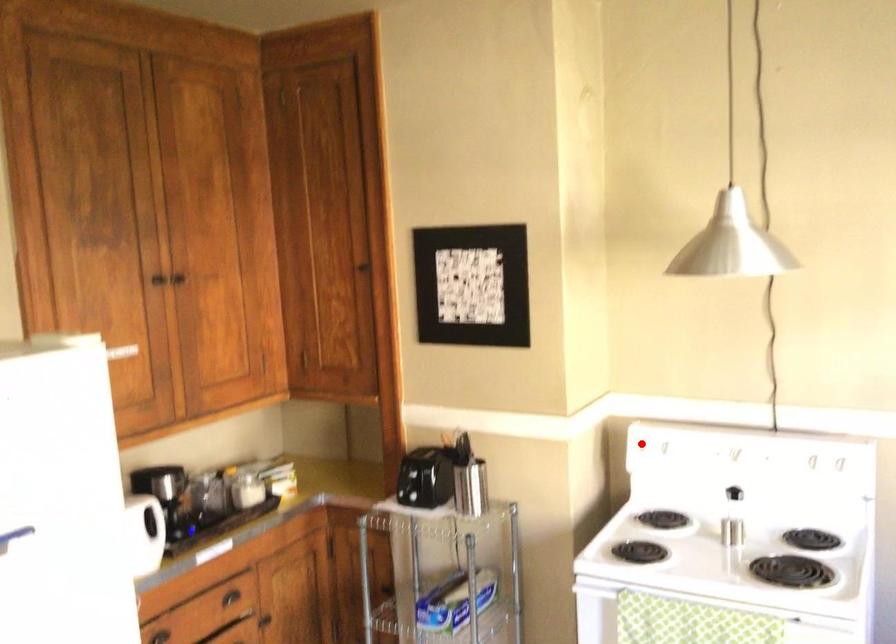
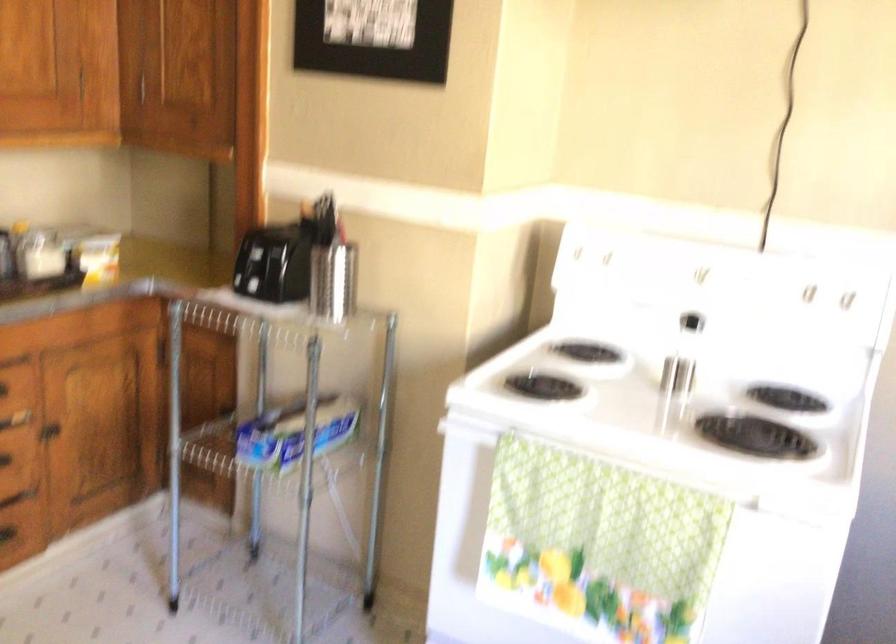
Question: I am providing you with two images of the same scene from different viewpoints. Image1 has a red point marked. In image2, the corresponding 3D location appears at what relative position? Reply with the corresponding letter.

Choices:
 (A) Closer
 (B) Farther

Answer: (A)